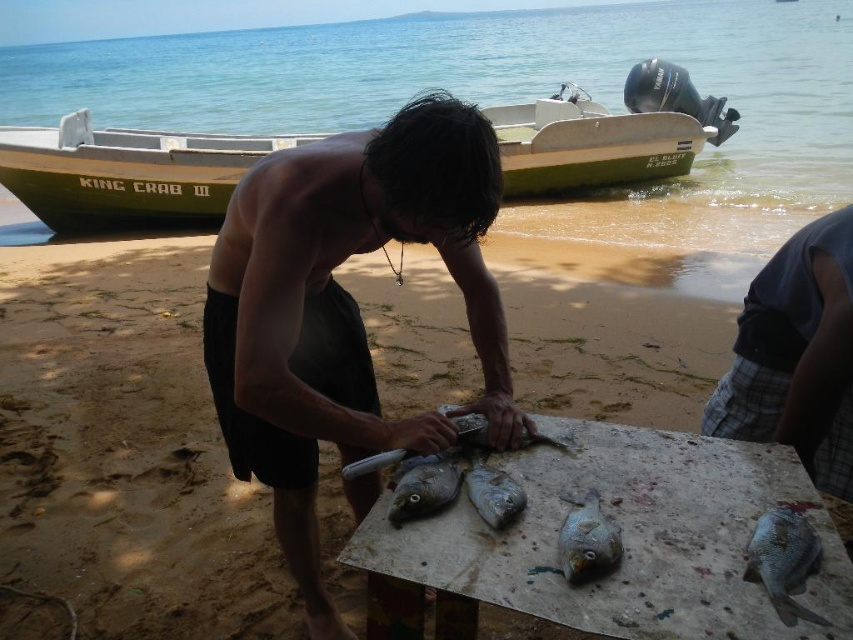
You are standing on the beach and see a point marked at coordinates point (125, 241). If you want to walk towards that point, how far will you have to walk?

The point (125, 241) is 7.20 meters away from the viewer, so you will have to walk 7.20 meters to reach it.

Based on the photo, you are a photographer trying to capture the man working on the white worn wood table at center. Since the sandy beach at center is underneath the table, will the sand be visible in the photo of the table?

The sandy beach at center is positioned under the white worn wood table at center, so the sand will not be visible in the photo of the table because the table is placed on top of it.